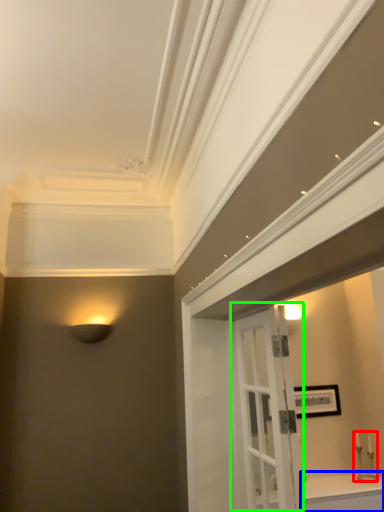
Question: Which is nearer to the candle holder (highlighted by a red box)? cabinetry (highlighted by a blue box) or door (highlighted by a green box).

Choices:
 (A) cabinetry
 (B) door

Answer: (A)